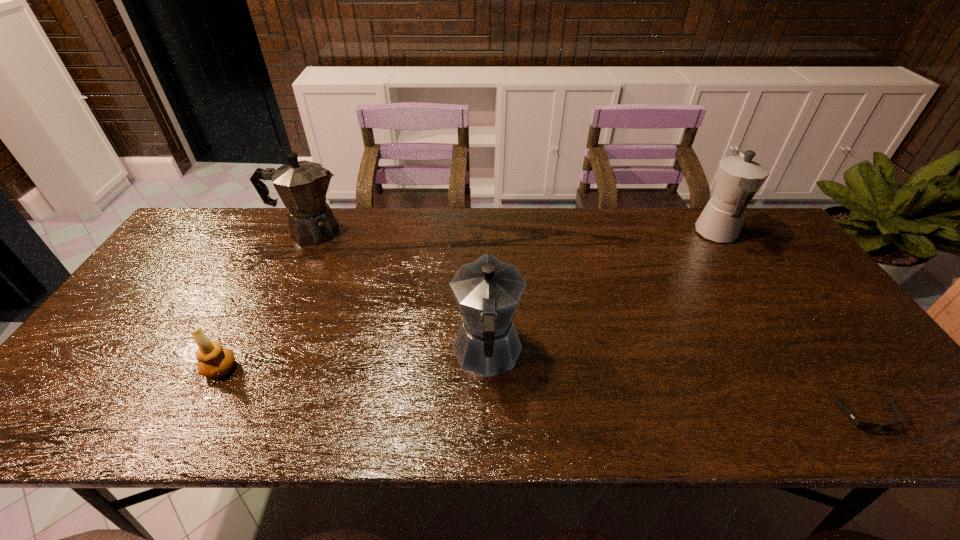
The height and width of the screenshot is (540, 960). I want to click on free space between the sunglasses and the leftmost coffeepot, so click(585, 321).

Identify the location of object that is the second closest to the leftmost coffeepot. Image resolution: width=960 pixels, height=540 pixels. (487, 291).

Select which object is the fourth closest to the fourth tallest object. Please provide its 2D coordinates. Your answer should be formatted as a tuple, i.e. [(x, y)], where the tuple contains the x and y coordinates of a point satisfying the conditions above.

[(862, 425)]

This screenshot has height=540, width=960. I want to click on coffeepot that is the second closest to the rightmost coffeepot, so click(x=302, y=186).

Locate which coffeepot ranks in proximity to the shortest object. Please provide its 2D coordinates. Your answer should be formatted as a tuple, i.e. [(x, y)], where the tuple contains the x and y coordinates of a point satisfying the conditions above.

[(739, 177)]

Locate an element on the screen. This screenshot has height=540, width=960. free space that satisfies the following two spatial constraints: 1. at the spout of the rightmost coffeepot; 2. on the right side of the second coffeepot from left to right is located at coordinates (486, 234).

I want to click on free spot that satisfies the following two spatial constraints: 1. on the pouring side of the leftmost coffeepot; 2. on the front side of the fourth tallest object, so click(247, 368).

This screenshot has width=960, height=540. Find the location of `free space in the image that satisfies the following two spatial constraints: 1. at the spout of the rightmost coffeepot; 2. on the right side of the second coffeepot from right to left`. free space in the image that satisfies the following two spatial constraints: 1. at the spout of the rightmost coffeepot; 2. on the right side of the second coffeepot from right to left is located at coordinates (486, 234).

You are a GUI agent. You are given a task and a screenshot of the screen. Output one action in this format:
    pyautogui.click(x=<x>, y=<y>)
    Task: Click on the free region that satisfies the following two spatial constraints: 1. on the pouring side of the leftmost coffeepot; 2. on the left side of the rightmost coffeepot
    The image size is (960, 540).
    Given the screenshot: What is the action you would take?
    pyautogui.click(x=309, y=234)

The width and height of the screenshot is (960, 540). What are the coordinates of `vacant space that satisfies the following two spatial constraints: 1. on the back side of the rightmost coffeepot; 2. on the pouring side of the leftmost coffeepot` in the screenshot? It's located at (716, 232).